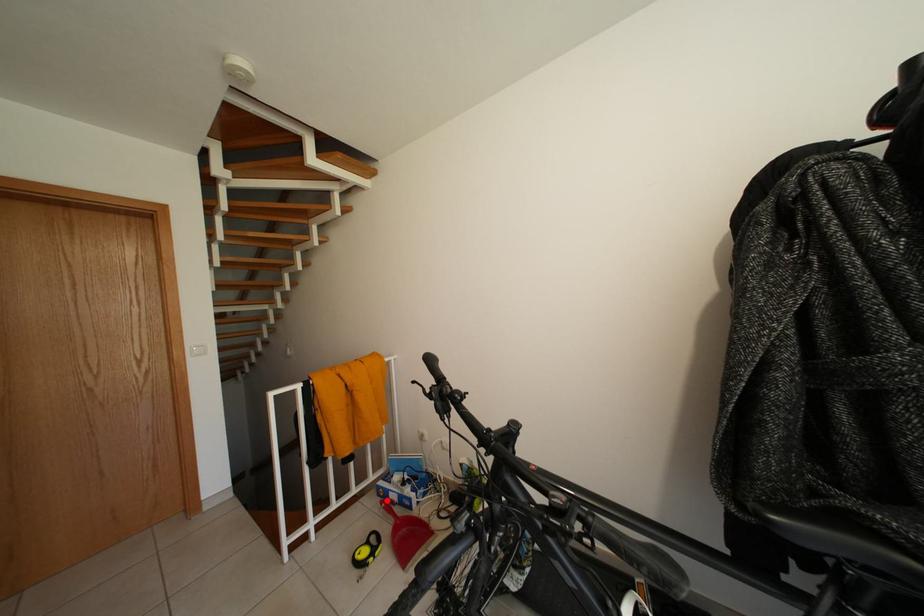
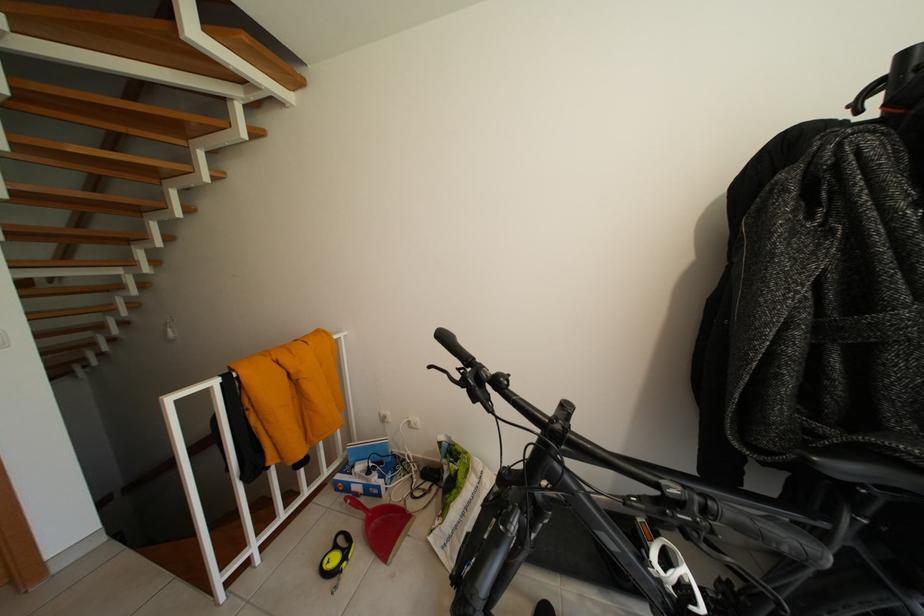
Find the pixel in the second image that matches the highlighted location in the first image.

(345, 495)